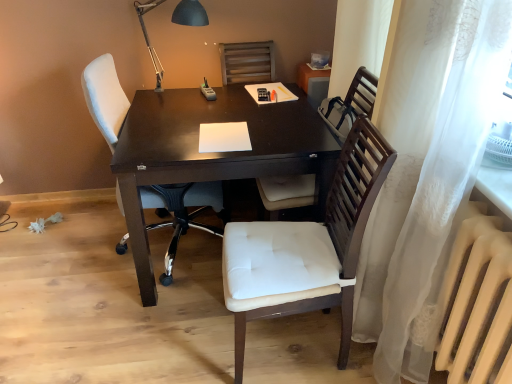
At what (x,y) coordinates should I click in order to perform the action: click on free region under white fabric chair at center, which is the second chair in left-to-right order (from a real-world perspective). Please return your answer as a coordinate pair (x, y). The width and height of the screenshot is (512, 384). Looking at the image, I should click on (295, 344).